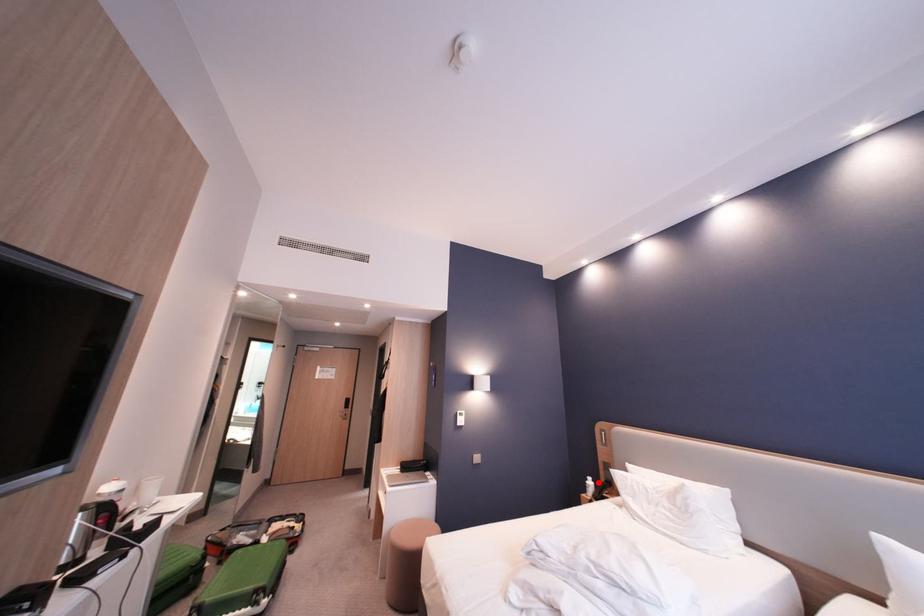
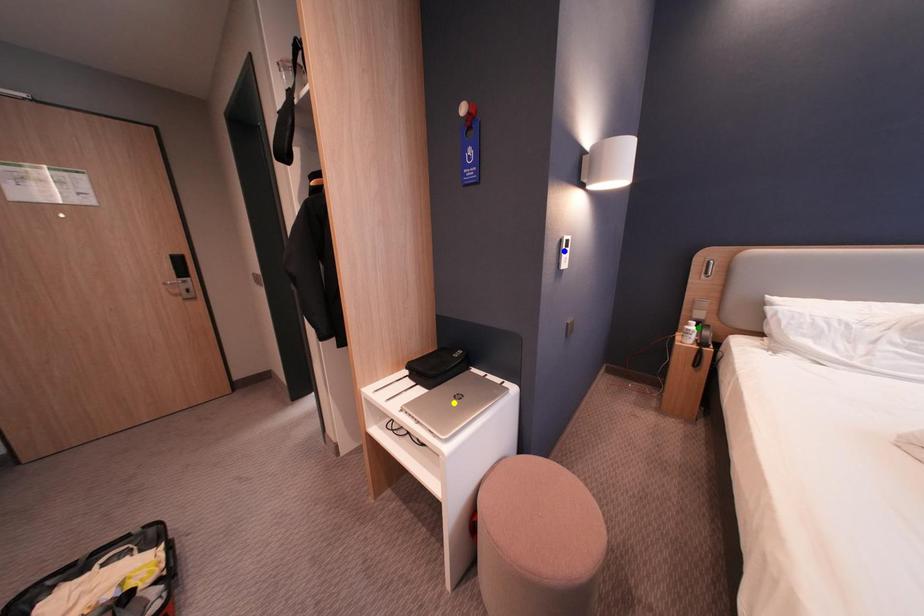
Question: I am providing you with two images of the same scene from different viewpoints. A red point is marked on the first image. You are given multiple points on the second image. Which point in image 2 is actually the same real-world point as the red point in image 1?

Choices:
 (A) blue point
 (B) green point
 (C) yellow point

Answer: (B)